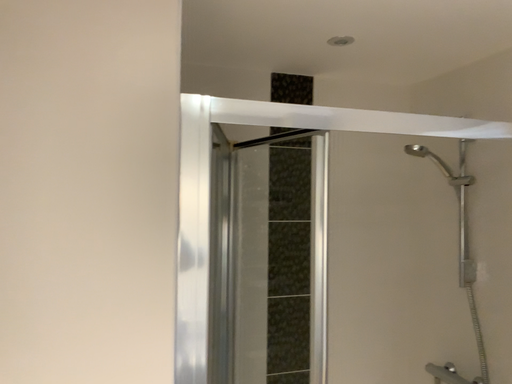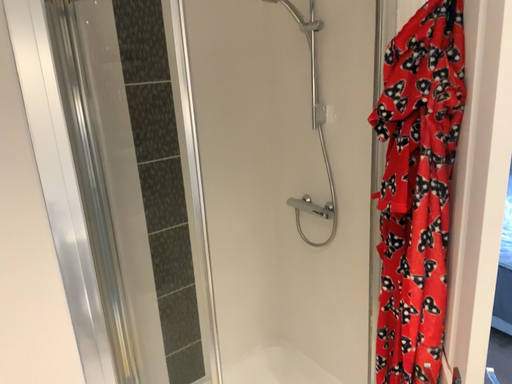
Question: Which way did the camera rotate in the video?

Choices:
 (A) rotated left
 (B) rotated right

Answer: (B)